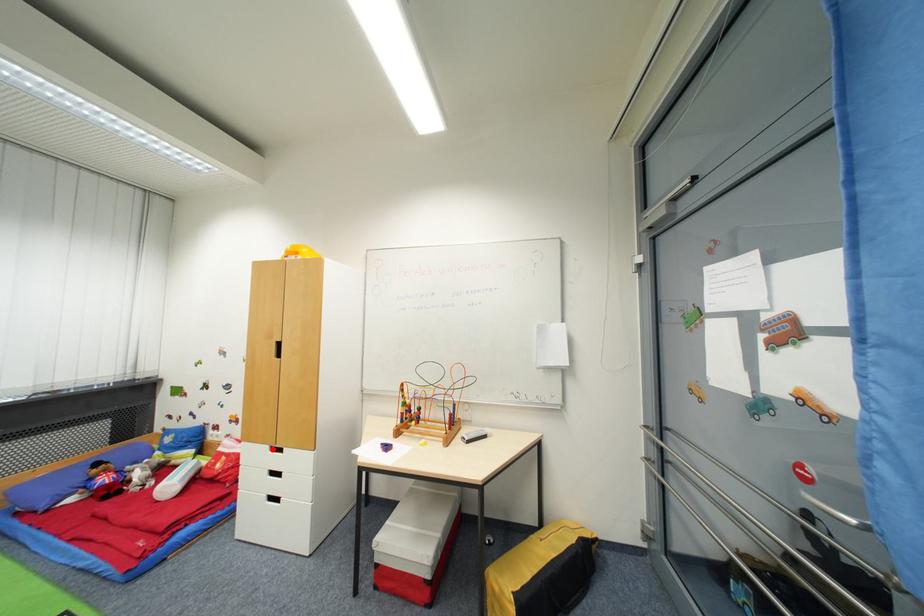
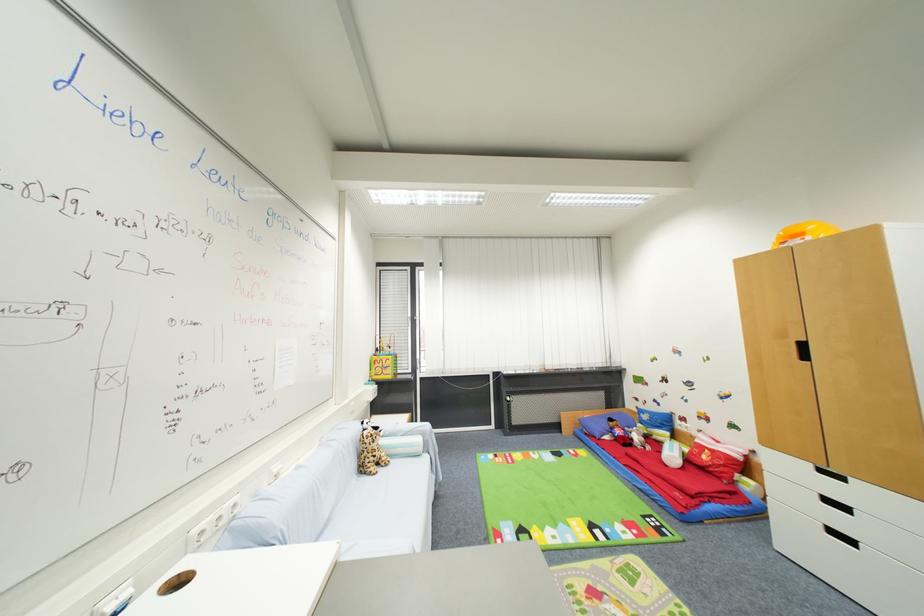
Question: I am providing you with two images of the same scene from different viewpoints. Image1 has a red point marked. In image2, the corresponding 3D location appears at what relative position? Reply with the corresponding letter.

Choices:
 (A) Closer
 (B) Farther

Answer: (A)